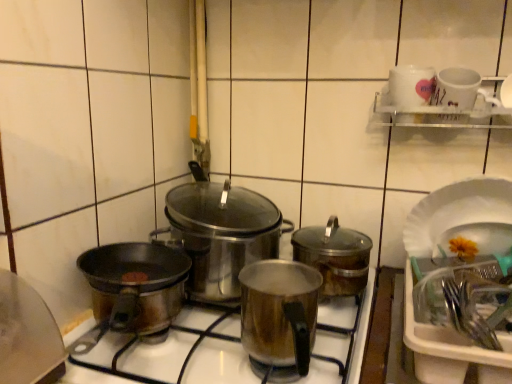
Describe the element at coordinates (219, 364) in the screenshot. I see `satin silver pot at center` at that location.

Describe the element at coordinates (411, 85) in the screenshot. I see `white glossy mug at upper right` at that location.

How much space does stainless steel pot at center, the 3th kitchen appliance positioned from the right, occupy horizontally?

It is 11.55 inches.

The width and height of the screenshot is (512, 384). Describe the element at coordinates (335, 256) in the screenshot. I see `shiny metallic pot at center, which is counted as the 3th kitchen appliance, starting from the left` at that location.

The width and height of the screenshot is (512, 384). Describe the element at coordinates (455, 211) in the screenshot. I see `white paper plate at right` at that location.

The height and width of the screenshot is (384, 512). I want to click on satin silver pot at center, so click(219, 364).

Between shiny metallic pot at center, which is the first kitchen appliance in right-to-left order, and satin silver pot at center, which one has larger size?

satin silver pot at center is bigger.

From the image's perspective, is shiny metallic pot at center, which is counted as the 3th kitchen appliance, starting from the left, on top of satin silver pot at center?

Yes.

Is shiny metallic pot at center, which is counted as the 3th kitchen appliance, starting from the left, oriented away from satin silver pot at center?

No, satin silver pot at center is not at the back of shiny metallic pot at center, which is counted as the 3th kitchen appliance, starting from the left.

Does shiny metallic pot at center, which is counted as the 3th kitchen appliance, starting from the left, have a greater width compared to satin silver pot at center?

No.

Is satin silver pot at center in contact with white glossy mug at upper right?

There is a gap between satin silver pot at center and white glossy mug at upper right.

Measure the distance from satin silver pot at center to white glossy mug at upper right.

satin silver pot at center and white glossy mug at upper right are 21.95 inches apart.

Which object is positioned more to the right, satin silver pot at center or white glossy mug at upper right?

white glossy mug at upper right is more to the right.

From a real-world perspective, is satin silver pot at center physically located above or below white glossy mug at upper right?

Clearly, from a real-world perspective, satin silver pot at center is below white glossy mug at upper right.

How many degrees apart are the facing directions of satin silver pot at center and white paper plate at right?

The angle between the facing direction of satin silver pot at center and the facing direction of white paper plate at right is 1.76 degrees.

Considering the sizes of objects satin silver pot at center and white paper plate at right in the image provided, who is wider, satin silver pot at center or white paper plate at right?

satin silver pot at center.

Are satin silver pot at center and white paper plate at right beside each other?

satin silver pot at center is not next to white paper plate at right, and they're not touching.

Does point (228, 359) come in front of point (438, 223)?

That is True.

Which object is thinner, white paper plate at right or shiny metallic pot at center, which is the 2th kitchen appliance in right-to-left order?

With smaller width is shiny metallic pot at center, which is the 2th kitchen appliance in right-to-left order.

Is white paper plate at right facing away from shiny metallic pot at center, positioned as the second kitchen appliance in left-to-right order?

white paper plate at right is not turned away from shiny metallic pot at center, positioned as the second kitchen appliance in left-to-right order.

From a real-world perspective, is white paper plate at right positioned above or below shiny metallic pot at center, positioned as the second kitchen appliance in left-to-right order?

white paper plate at right is above shiny metallic pot at center, positioned as the second kitchen appliance in left-to-right order.

Consider the image. From the image's perspective, would you say white paper plate at right is shown under shiny metallic pot at center, positioned as the second kitchen appliance in left-to-right order?

No, from the image's perspective, white paper plate at right is not beneath shiny metallic pot at center, positioned as the second kitchen appliance in left-to-right order.

Can you tell me how much shiny metallic pot at center, which is counted as the 3th kitchen appliance, starting from the left, and shiny metallic pot at center, positioned as the second kitchen appliance in left-to-right order, differ in facing direction?

The angular difference between shiny metallic pot at center, which is counted as the 3th kitchen appliance, starting from the left, and shiny metallic pot at center, positioned as the second kitchen appliance in left-to-right order, is 1.67 degrees.

From the image's perspective, which kitchen appliance is the 1st one above the shiny metallic pot at center, positioned as the second kitchen appliance in left-to-right order? Please provide its 2D coordinates.

[(335, 256)]

From a real-world perspective, between shiny metallic pot at center, which is the first kitchen appliance in right-to-left order, and shiny metallic pot at center, positioned as the second kitchen appliance in left-to-right order, who is vertically lower?

shiny metallic pot at center, positioned as the second kitchen appliance in left-to-right order, is physically lower.

Is shiny metallic pot at center, which is the first kitchen appliance in right-to-left order, next to shiny metallic pot at center, which is the 2th kitchen appliance in right-to-left order, and touching it?

shiny metallic pot at center, which is the first kitchen appliance in right-to-left order, and shiny metallic pot at center, which is the 2th kitchen appliance in right-to-left order, are clearly separated.

Is satin silver pot at center next to shiny metallic pot at center, which is counted as the 3th kitchen appliance, starting from the left?

No, satin silver pot at center is not next to shiny metallic pot at center, which is counted as the 3th kitchen appliance, starting from the left.

Image resolution: width=512 pixels, height=384 pixels. I want to click on gas stove in front of the shiny metallic pot at center, which is counted as the 3th kitchen appliance, starting from the left, so click(219, 364).

Is satin silver pot at center facing away from shiny metallic pot at center, which is counted as the 3th kitchen appliance, starting from the left?

satin silver pot at center is not turned away from shiny metallic pot at center, which is counted as the 3th kitchen appliance, starting from the left.

Based on the photo, is white paper plate at right next to stainless steel pot at center, the 3th kitchen appliance positioned from the right?

No, white paper plate at right is not beside stainless steel pot at center, the 3th kitchen appliance positioned from the right.

Is white paper plate at right oriented towards stainless steel pot at center, the first kitchen appliance from the left?

No, white paper plate at right is not turned towards stainless steel pot at center, the first kitchen appliance from the left.

Find the location of `platter above the stainless steel pot at center, the first kitchen appliance from the left (from a real-world perspective)`. platter above the stainless steel pot at center, the first kitchen appliance from the left (from a real-world perspective) is located at coordinates (455, 211).

From the image's perspective, count 2nd kitchen appliances upward from the satin silver pot at center and point to it. Please provide its 2D coordinates.

[(335, 256)]

Locate an element on the screen. The image size is (512, 384). gas stove on the left of white glossy mug at upper right is located at coordinates (219, 364).

Considering their positions, is satin silver pot at center positioned closer to shiny metallic pot at center, positioned as the second kitchen appliance in left-to-right order, than shiny metallic pot at center, which is the first kitchen appliance in right-to-left order?

satin silver pot at center lies closer to shiny metallic pot at center, positioned as the second kitchen appliance in left-to-right order, than the other object.

Looking at the image, which one is located further to shiny metallic pot at center, positioned as the second kitchen appliance in left-to-right order, stainless steel pot at center, the first kitchen appliance from the left, or satin silver pot at center?

→ Among the two, stainless steel pot at center, the first kitchen appliance from the left, is located further to shiny metallic pot at center, positioned as the second kitchen appliance in left-to-right order.

Which object lies nearer to the anchor point white paper plate at right, shiny metallic pot at center, positioned as the second kitchen appliance in left-to-right order, or white glossy mug at upper right?

white glossy mug at upper right lies closer to white paper plate at right than the other object.

When comparing their distances from stainless steel pot at center, the first kitchen appliance from the left, does satin silver pot at center or shiny metallic pot at center, which is the first kitchen appliance in right-to-left order, seem closer?

The object closer to stainless steel pot at center, the first kitchen appliance from the left, is shiny metallic pot at center, which is the first kitchen appliance in right-to-left order.

Considering their positions, is stainless steel pot at center, the first kitchen appliance from the left, positioned closer to satin silver pot at center than white glossy mug at upper right?

stainless steel pot at center, the first kitchen appliance from the left, lies closer to satin silver pot at center than the other object.

Considering their positions, is shiny metallic pot at center, which is counted as the 3th kitchen appliance, starting from the left, positioned further to stainless steel pot at center, the first kitchen appliance from the left, than white glossy mug at upper right?

white glossy mug at upper right is positioned further to the anchor stainless steel pot at center, the first kitchen appliance from the left.

From the image, which object appears to be nearer to stainless steel pot at center, the first kitchen appliance from the left, shiny metallic pot at center, which is the 2th kitchen appliance in right-to-left order, or satin silver pot at center?

shiny metallic pot at center, which is the 2th kitchen appliance in right-to-left order, is positioned closer to the anchor stainless steel pot at center, the first kitchen appliance from the left.

Estimate the real-world distances between objects in this image. Which object is closer to stainless steel pot at center, the first kitchen appliance from the left, shiny metallic pot at center, positioned as the second kitchen appliance in left-to-right order, or white glossy mug at upper right?

shiny metallic pot at center, positioned as the second kitchen appliance in left-to-right order, lies closer to stainless steel pot at center, the first kitchen appliance from the left, than the other object.

At what (x,y) coordinates should I click in order to perform the action: click on platter that lies between white glossy mug at upper right and satin silver pot at center from top to bottom. Please return your answer as a coordinate pair (x, y). This screenshot has width=512, height=384. Looking at the image, I should click on tap(455, 211).

This screenshot has height=384, width=512. Find the location of `gas stove situated between stainless steel pot at center, the 3th kitchen appliance positioned from the right, and white paper plate at right from left to right`. gas stove situated between stainless steel pot at center, the 3th kitchen appliance positioned from the right, and white paper plate at right from left to right is located at coordinates (219, 364).

Identify the location of platter between white glossy mug at upper right and shiny metallic pot at center, which is the first kitchen appliance in right-to-left order, vertically. (455, 211).

This screenshot has width=512, height=384. Identify the location of platter between white glossy mug at upper right and shiny metallic pot at center, positioned as the second kitchen appliance in left-to-right order, in the vertical direction. (455, 211).